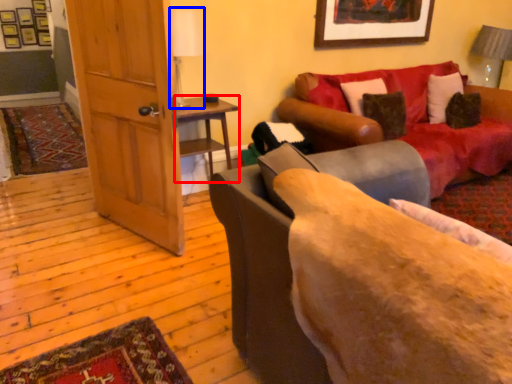
Question: Which of the following is the farthest to the observer, table (highlighted by a red box) or table lamp (highlighted by a blue box)?

Choices:
 (A) table
 (B) table lamp

Answer: (A)